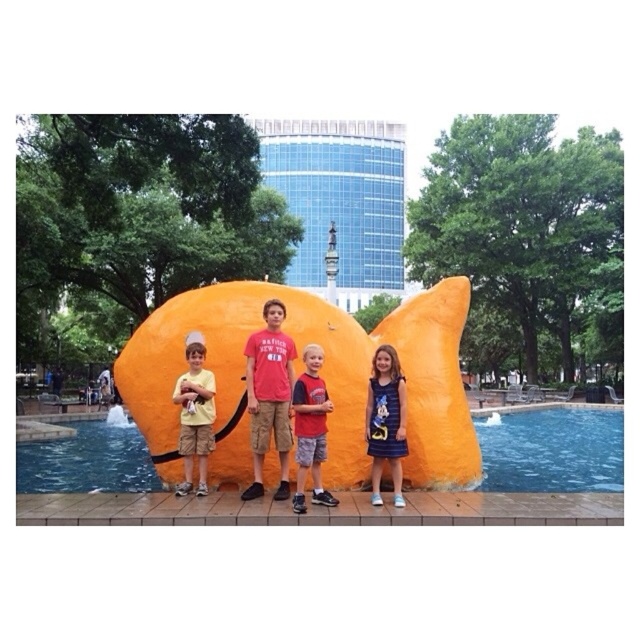
Question: Which point is closer to the camera?

Choices:
 (A) (388, 458)
 (B) (168, 468)
 (C) (212, 419)

Answer: (A)

Question: Is blue denim dress at center thinner than red cotton shirt at center?

Choices:
 (A) no
 (B) yes

Answer: (B)

Question: Does blue denim dress at center appear on the left side of red cotton shirt at center?

Choices:
 (A) yes
 (B) no

Answer: (B)

Question: Is blue denim dress at center further to camera compared to matte yellow shorts at center?

Choices:
 (A) yes
 (B) no

Answer: (B)

Question: Considering the real-world distances, which object is closest to the red cotton shirt at center?

Choices:
 (A) blue denim dress at center
 (B) matte yellow shorts at center
 (C) orange fabric fish at center

Answer: (A)

Question: Which of the following is the farthest from the observer?

Choices:
 (A) blue denim dress at center
 (B) orange fabric fish at center
 (C) matte yellow shorts at center
 (D) red cotton shirt at center

Answer: (B)